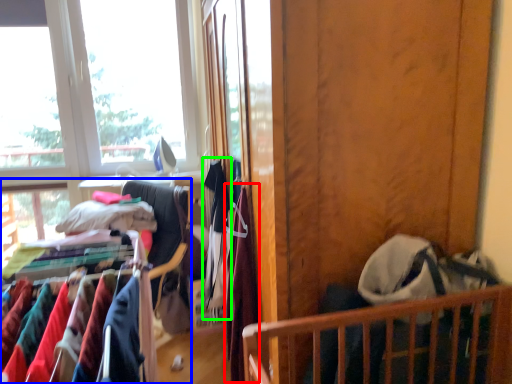
Question: Estimate the real-world distances between objects in this image. Which object is farther from clothing (highlighted by a red box), closet (highlighted by a blue box) or clothing (highlighted by a green box)?

Choices:
 (A) closet
 (B) clothing

Answer: (A)